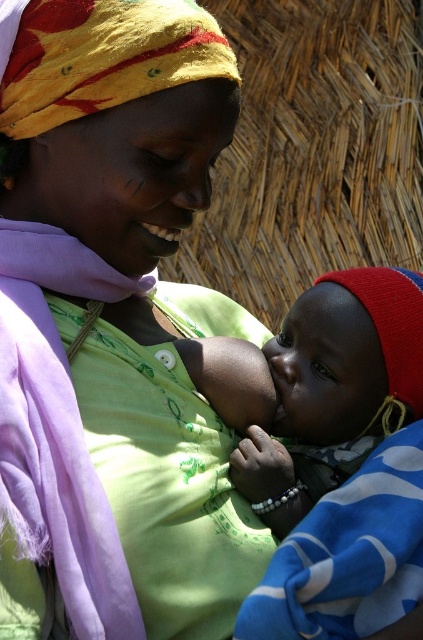
You are observing a mother and baby in a photograph. The woman is wearing a green matte shirt at center, and the baby is wrapped in a soft blue fabric at center. Based on the image, which item is positioned higher up on the body?

The green matte shirt at center is taller than the soft blue fabric at center, so the green matte shirt at center is positioned higher up on the body.

You are a photographer trying to capture a closeup of the green matte shirt at center and the soft blue fabric at center. Which object should you focus on first to ensure both are in focus?

The green matte shirt at center is closer to the viewer than the soft blue fabric at center, so focus on the green matte shirt at center first to ensure both are in focus.

You are a photographer standing at a safe distance. You want to capture a closeup shot of the green matte shirt at center. Considering the distance, is it possible to take the photo without moving closer?

The green matte shirt at center is 10.43 meters from the camera, so it is possible to take a closeup shot without moving closer by using a zoom lens.